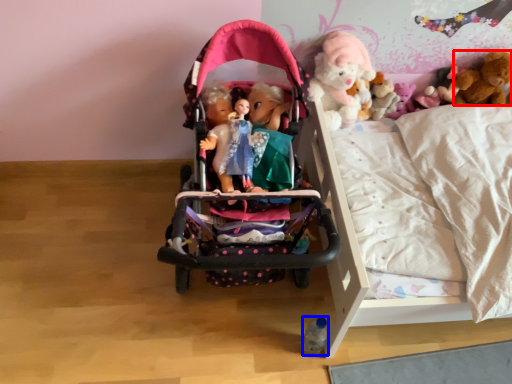
Question: Among these objects, which one is nearest to the camera, toy (highlighted by a red box) or toy (highlighted by a blue box)?

Choices:
 (A) toy
 (B) toy

Answer: (B)